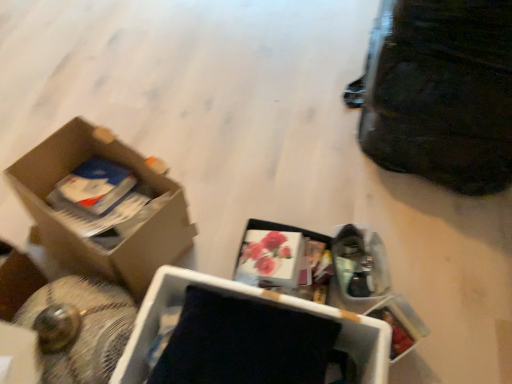
Image resolution: width=512 pixels, height=384 pixels. In order to click on vacant area that lies to the right of cardboard box at left, acting as the 2th box starting from the right in this screenshot , I will do `click(238, 203)`.